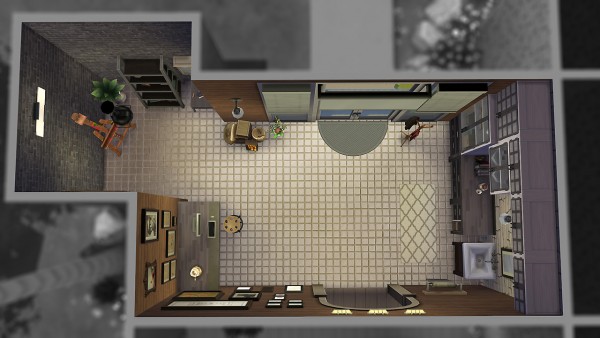
Identify the location of shelf. Image resolution: width=600 pixels, height=338 pixels. (153, 93).